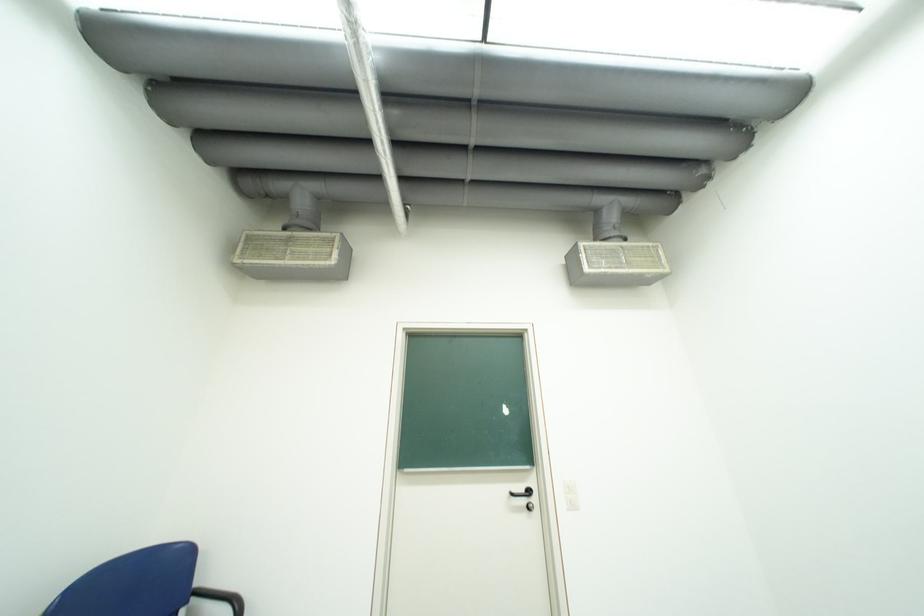
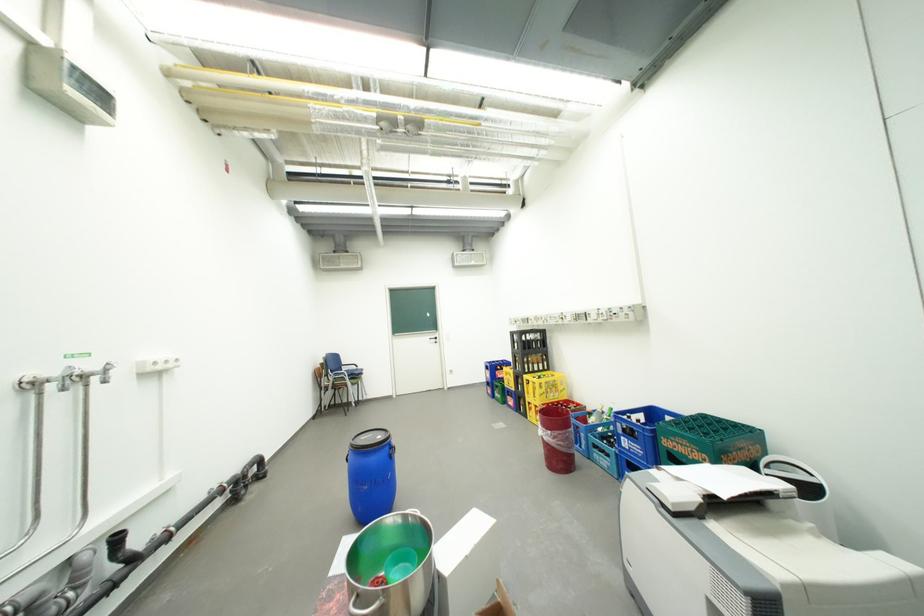
Question: In a continuous first-person perspective shot, in which direction is the camera moving?

Choices:
 (A) Left
 (B) Right
 (C) Forward
 (D) Backward

Answer: (D)